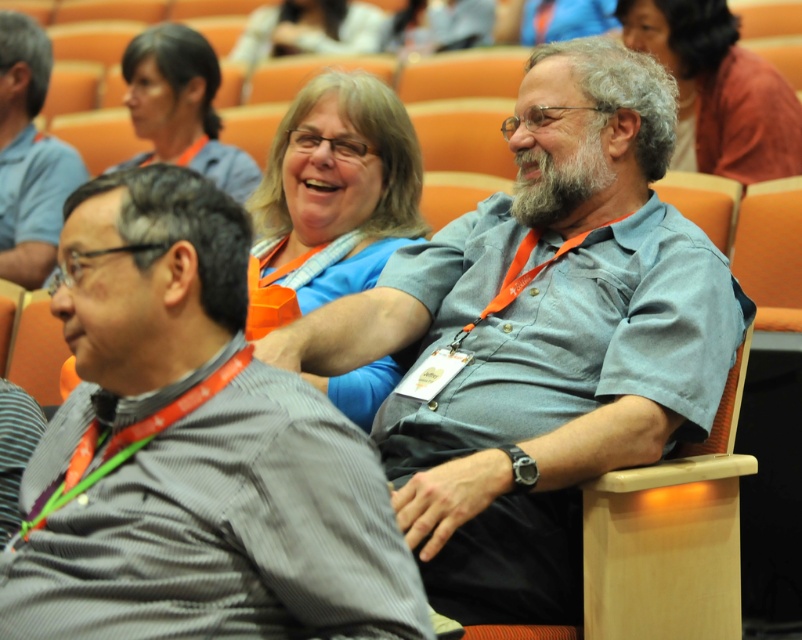
Question: Which of the following is the farthest from the observer?

Choices:
 (A) (456, 566)
 (B) (5, 140)
 (C) (235, 205)
 (D) (691, 77)

Answer: (B)

Question: Which point is closer to the camera taking this photo?

Choices:
 (A) (355, 51)
 (B) (300, 205)
 (C) (213, 557)

Answer: (C)

Question: Does gray striped shirt at left lie in front of matte orange lanyard at upper center?

Choices:
 (A) yes
 (B) no

Answer: (A)

Question: From the image, what is the correct spatial relationship of gray striped shirt at center in relation to matte orange lanyard at upper center?

Choices:
 (A) right
 (B) left

Answer: (A)

Question: Where is matte orange lanyard at upper center located in relation to matte blue shirt at upper center in the image?

Choices:
 (A) below
 (B) above

Answer: (A)

Question: Among these objects, which one is nearest to the camera?

Choices:
 (A) gray striped shirt at center
 (B) blue fabric shirt at center
 (C) gray striped shirt at left

Answer: (A)